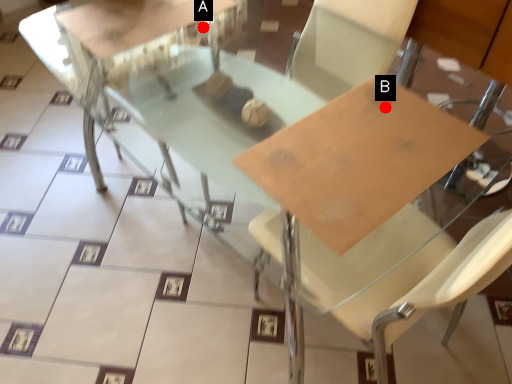
Question: Two points are circled on the image, labeled by A and B beside each circle. Which point is further to the camera?

Choices:
 (A) A is further
 (B) B is further

Answer: (A)